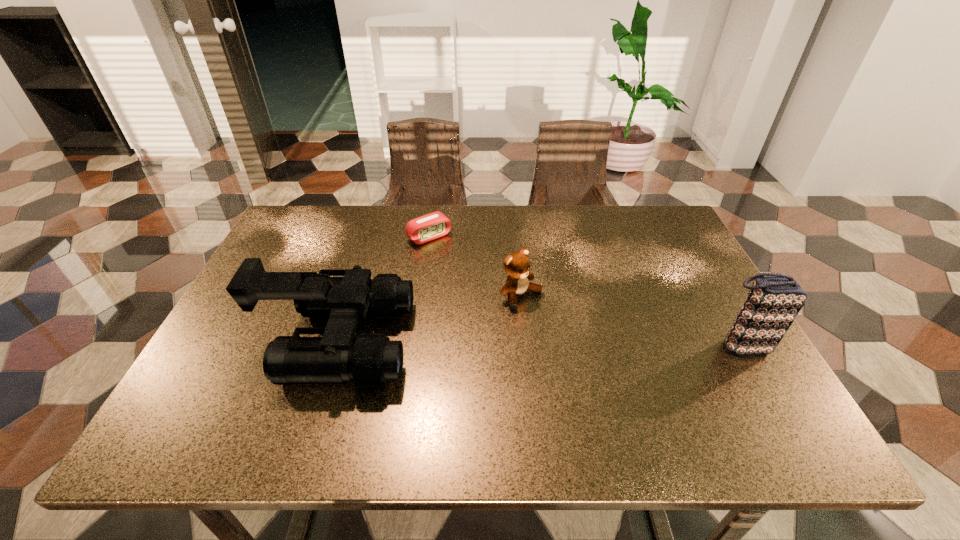
This screenshot has width=960, height=540. I want to click on vacant spot on the desktop that is between the binoculars and the rightmost object and is positioned on the front-facing side of the farthest object, so click(538, 343).

Find the location of a particular element. Image resolution: width=960 pixels, height=540 pixels. free space on the desktop that is between the binoculars and the clutch bag and is positioned on the front-facing side of the teddy bear is located at coordinates (582, 344).